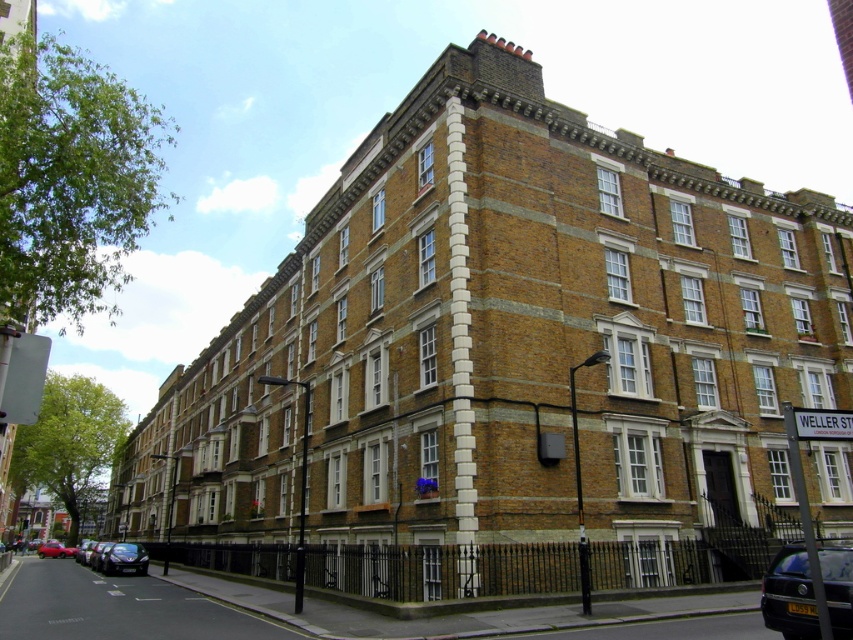
You are a delivery person trying to park your van, which is 2 meters wide, near the black metallic car at lower right. Based on the scene, can you estimate if there is enough space between the car and the black metal fence to park your van?

The black metallic car at lower right is located at point (788, 595). Since the coordinates are close to the corner, there might not be sufficient space between the car and the fence to accommodate a 2 meter wide van. It is recommended to look for another parking spot.

You are a delivery driver who needs to park your car between the black metallic car at lower right and the shiny red car at lower left. The parking space you need is exactly 160 meters long. Can you fit your car in this space?

The distance between the black metallic car at lower right and the shiny red car at lower left is 159.39 meters, which is slightly shorter than the required 160 meters. Therefore, the parking space is not long enough to accommodate your car.